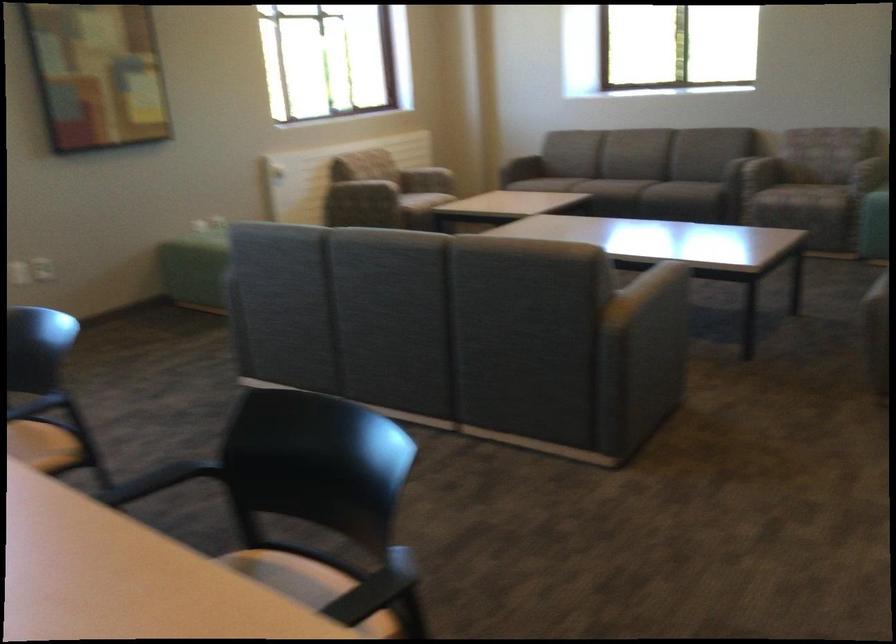
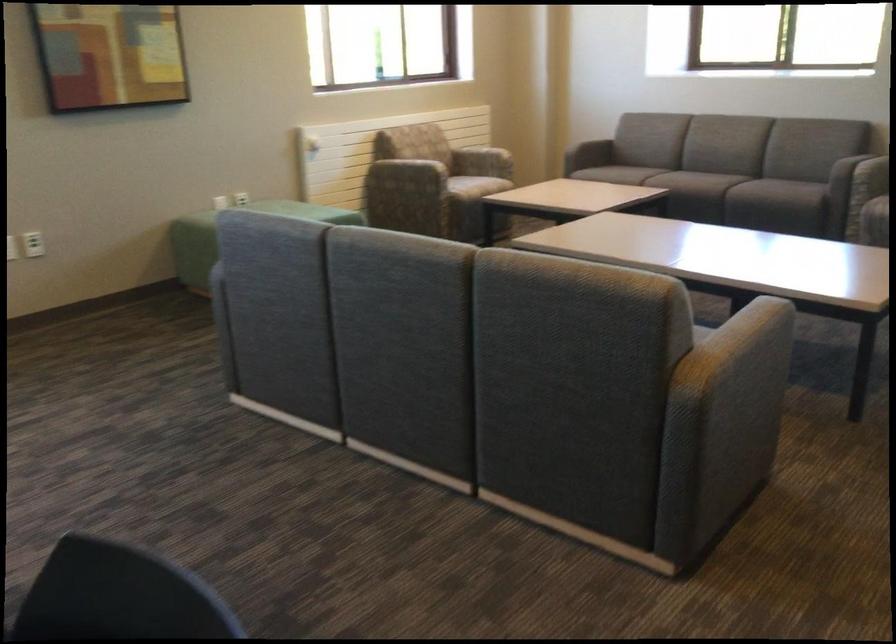
Question: Based on the continuous images, in which direction is the camera rotating? Reply with the corresponding letter.

Choices:
 (A) Left
 (B) Right
 (C) Up
 (D) Down

Answer: (A)